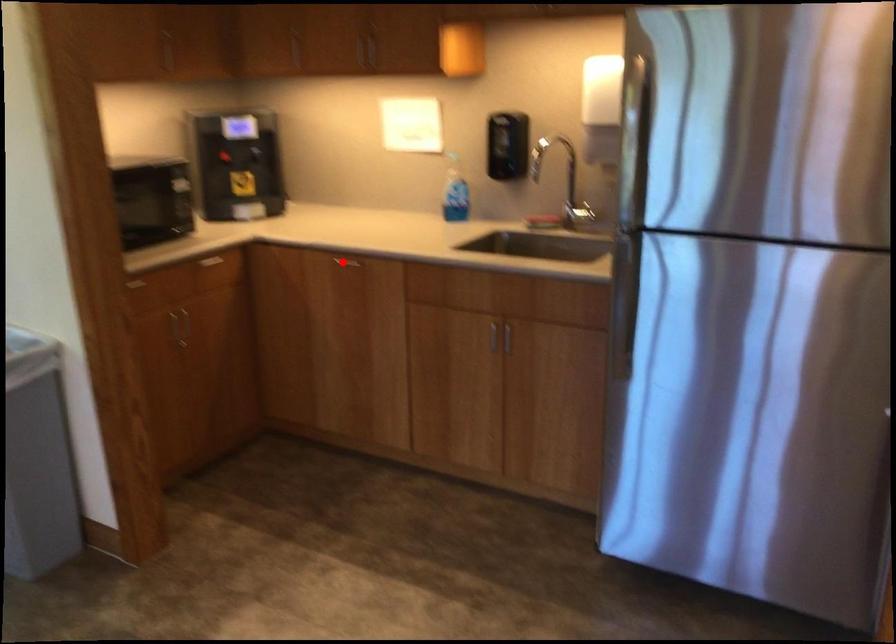
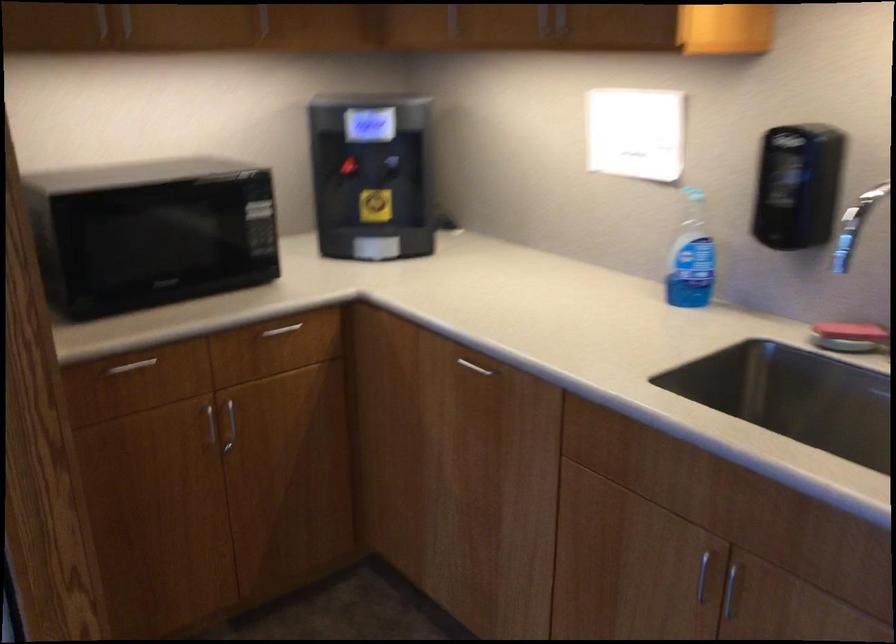
Question: A red point is marked in image1. In image2, is the corresponding 3D point closer to the camera or farther? Reply with the corresponding letter.

Choices:
 (A) The corresponding 3D point is closer.
 (B) The corresponding 3D point is farther.

Answer: (A)